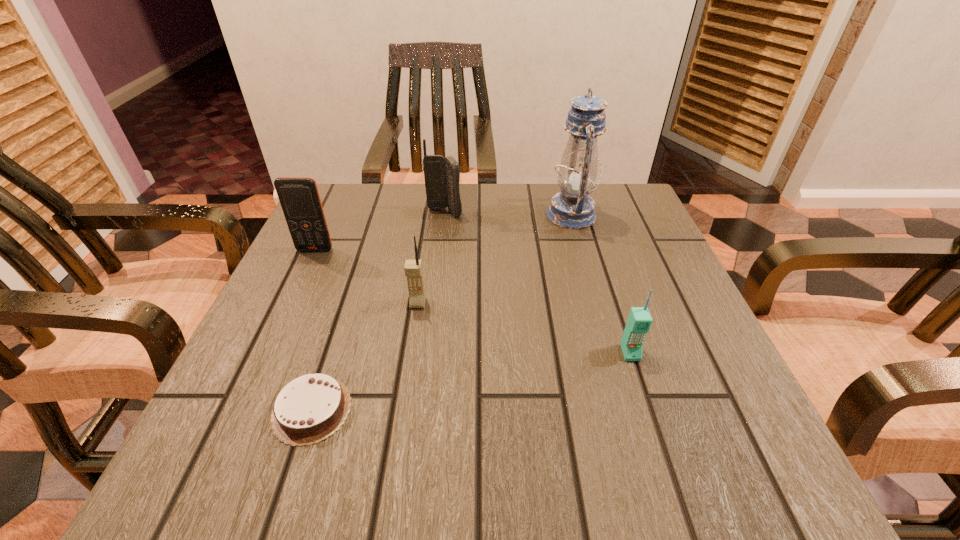
The height and width of the screenshot is (540, 960). What are the coordinates of `free spot located 0.330m on the front-facing side of the lantern` in the screenshot? It's located at (407, 215).

The width and height of the screenshot is (960, 540). I want to click on free spot located 0.220m on the front-facing side of the lantern, so coord(453,215).

Identify the location of free space located on the keyboard of the farthest cellular telephone. The height and width of the screenshot is (540, 960). (435, 295).

Where is `free point located 0.340m on the screen of the fourth nearest object`? The height and width of the screenshot is (540, 960). free point located 0.340m on the screen of the fourth nearest object is located at coordinates (252, 387).

Image resolution: width=960 pixels, height=540 pixels. In order to click on vacant space located 0.310m on the front of the fourth farthest object, where the keypad is located in this screenshot , I will do `click(392, 477)`.

In order to click on free location located on the keypad of the fifth tallest object in this screenshot , I will do `click(641, 388)`.

The height and width of the screenshot is (540, 960). I want to click on free spot located 0.050m on the back of the chocolate cake, so click(x=330, y=353).

Where is `lantern that is positioned at the far edge`? lantern that is positioned at the far edge is located at coordinates (572, 208).

Locate an element on the screen. cellular telephone at the far edge is located at coordinates (442, 174).

You are a GUI agent. You are given a task and a screenshot of the screen. Output one action in this format:
    pyautogui.click(x=<x>, y=<y>)
    Task: Click on the object located in the near edge section of the desktop
    
    Given the screenshot: What is the action you would take?
    pyautogui.click(x=309, y=409)